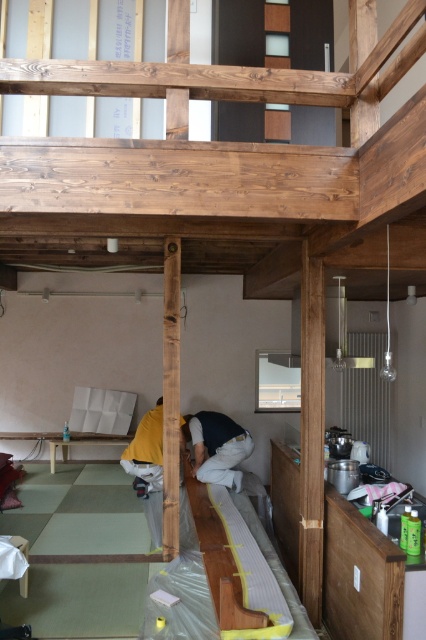
You are an interior designer assessing the space for safety. The smooth wood beam at center and the yellow fabric at lower center are in your line of sight. Which object is positioned higher in the vertical plane?

The smooth wood beam at center is taller than yellow fabric at lower center, so the smooth wood beam at center is positioned higher.

You are an inspector standing at the entrance of the room. You see the smooth wood beam at center and the yellow fabric at lower center. Which object is closer to you?

The smooth wood beam at center is closer to you because it is in front of the yellow fabric at lower center.

You are standing at the entrance of the room and see the dark blue fabric at center. Can you estimate its location in terms of coordinates?

The dark blue fabric at center is located at coordinates point (218, 448).